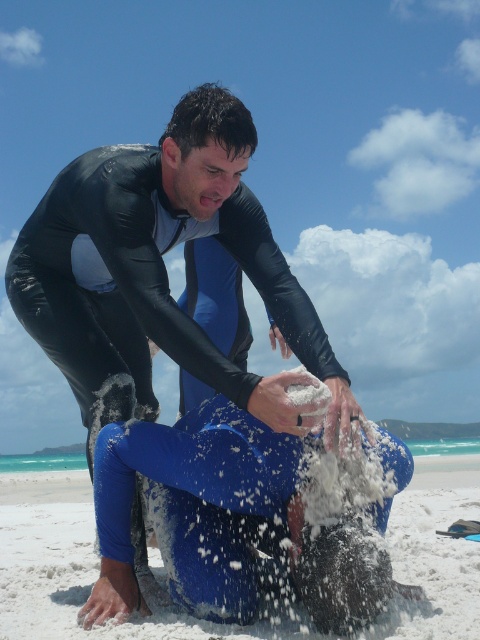
Is point (127, 285) farther from camera compared to point (477, 512)?

No, it is not.

Who is shorter, black wetsuit at center or blue fabric at lower center?

With less height is blue fabric at lower center.

Who is more distant from viewer, [278,416] or [474,488]?

The point [474,488] is behind.

Find the location of a particular element. This screenshot has height=640, width=480. black wetsuit at center is located at coordinates (164, 275).